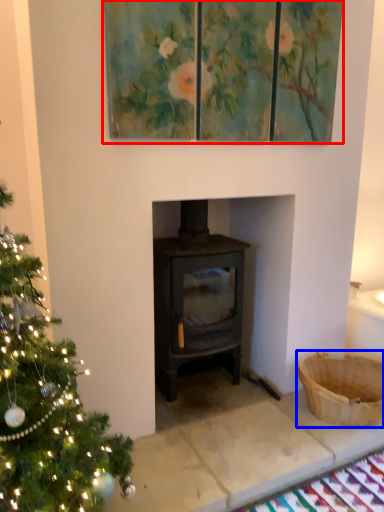
Question: Which of the following is the farthest to the observer, oil painting (highlighted by a red box) or basket (highlighted by a blue box)?

Choices:
 (A) oil painting
 (B) basket

Answer: (B)